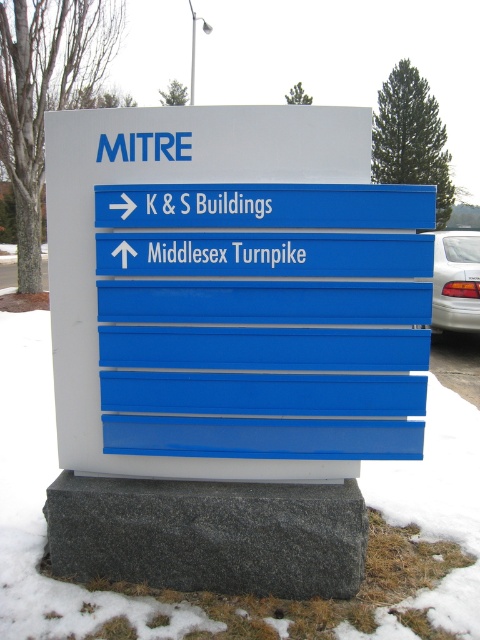
Locate an element on the screen. blue plastic sign at center is located at coordinates [x=232, y=292].

Can you confirm if blue plastic sign at center is positioned to the left of white glossy sedan at right?

Yes, blue plastic sign at center is to the left of white glossy sedan at right.

This screenshot has width=480, height=640. Identify the location of blue plastic sign at center. (232, 292).